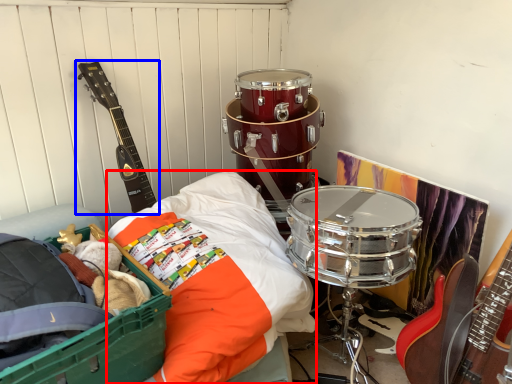
Question: Among these objects, which one is nearest to the camera, sheet (highlighted by a red box) or guitar (highlighted by a blue box)?

Choices:
 (A) sheet
 (B) guitar

Answer: (A)